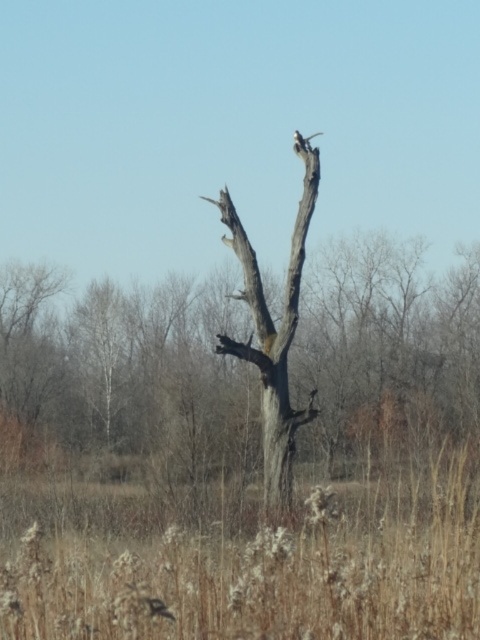
You are a hiker who has just arrived at the scene and wants to cross from the left side to the right side of the gray rough bark tree at center. Since the brown dry grass at center is in the way, can you step over it?

The brown dry grass at center is to the left of gray rough bark tree at center, so you can step over it to reach the right side of the tree.